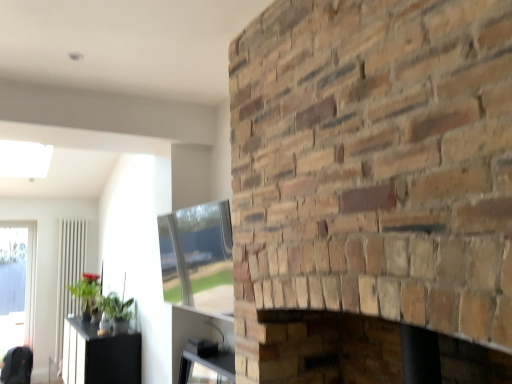
Question: From the image's perspective, does natural stone fireplace at center appear lower than white glossy radiator at left?

Choices:
 (A) no
 (B) yes

Answer: (A)

Question: Does natural stone fireplace at center have a larger size compared to white glossy radiator at left?

Choices:
 (A) yes
 (B) no

Answer: (A)

Question: Is natural stone fireplace at center closer to the viewer compared to white glossy radiator at left?

Choices:
 (A) yes
 (B) no

Answer: (A)

Question: Is natural stone fireplace at center taller than white glossy radiator at left?

Choices:
 (A) no
 (B) yes

Answer: (A)

Question: Is natural stone fireplace at center wider than white glossy radiator at left?

Choices:
 (A) no
 (B) yes

Answer: (B)

Question: Looking at their shapes, would you say black glossy table at lower left is wider or thinner than white glossy radiator at left?

Choices:
 (A) wide
 (B) thin

Answer: (A)

Question: Is black glossy table at lower left inside or outside of white glossy radiator at left?

Choices:
 (A) outside
 (B) inside

Answer: (A)

Question: Is point (114, 369) closer or farther from the camera than point (70, 284)?

Choices:
 (A) farther
 (B) closer

Answer: (B)

Question: From a real-world perspective, is black glossy table at lower left positioned above or below white glossy radiator at left?

Choices:
 (A) above
 (B) below

Answer: (B)

Question: Based on their sizes in the image, would you say natural stone fireplace at center is bigger or smaller than green matte plant at left, the 2th plant viewed from the right?

Choices:
 (A) big
 (B) small

Answer: (A)

Question: Considering the positions of natural stone fireplace at center and green matte plant at left, the 2th plant viewed from the right, in the image, is natural stone fireplace at center taller or shorter than green matte plant at left, the 2th plant viewed from the right,?

Choices:
 (A) short
 (B) tall

Answer: (B)

Question: Looking at their shapes, would you say natural stone fireplace at center is wider or thinner than green matte plant at left, the 1th plant from the left?

Choices:
 (A) thin
 (B) wide

Answer: (B)

Question: Considering the relative positions of natural stone fireplace at center and green matte plant at left, the 1th plant from the left, in the image provided, is natural stone fireplace at center to the left or to the right of green matte plant at left, the 1th plant from the left,?

Choices:
 (A) right
 (B) left

Answer: (A)

Question: Considering their positions, is green leafy plant at lower left, the first plant when ordered from front to back, located in front of or behind white glossy radiator at left?

Choices:
 (A) behind
 (B) front

Answer: (B)

Question: In terms of height, does green leafy plant at lower left, acting as the 1th plant starting from the right, look taller or shorter compared to white glossy radiator at left?

Choices:
 (A) short
 (B) tall

Answer: (A)